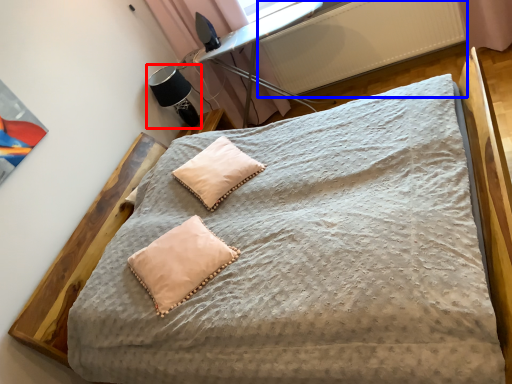
Question: Among these objects, which one is farthest to the camera, table lamp (highlighted by a red box) or radiator (highlighted by a blue box)?

Choices:
 (A) table lamp
 (B) radiator

Answer: (A)